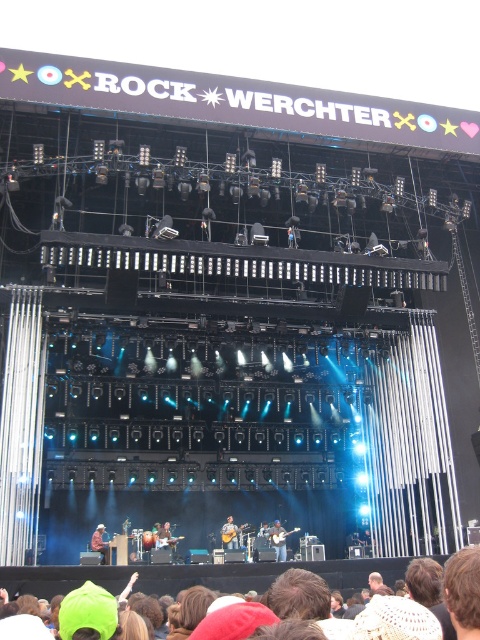
Which of these two, light brown wood guitar at center or shiny brown guitar at center, stands taller?

light brown wood guitar at center

Where is `light brown wood guitar at center`? Image resolution: width=480 pixels, height=640 pixels. light brown wood guitar at center is located at coordinates (278, 540).

Is wooden acoustic guitar at center smaller than brown leather jacket at center?

Indeed, wooden acoustic guitar at center has a smaller size compared to brown leather jacket at center.

What do you see at coordinates (229, 532) in the screenshot? I see `wooden acoustic guitar at center` at bounding box center [229, 532].

Which is behind, point (225, 531) or point (96, 528)?

Positioned behind is point (225, 531).

In order to click on wooden acoustic guitar at center in this screenshot , I will do `click(229, 532)`.

Between wooden acoustic guitar at center and shiny brown guitar at center, which one is positioned higher?

shiny brown guitar at center is higher up.

Does wooden acoustic guitar at center have a lesser height compared to shiny brown guitar at center?

Incorrect, wooden acoustic guitar at center's height does not fall short of shiny brown guitar at center's.

Locate an element on the screen. wooden acoustic guitar at center is located at coordinates coord(229,532).

Locate an element on the screen. The height and width of the screenshot is (640, 480). wooden acoustic guitar at center is located at coordinates (229, 532).